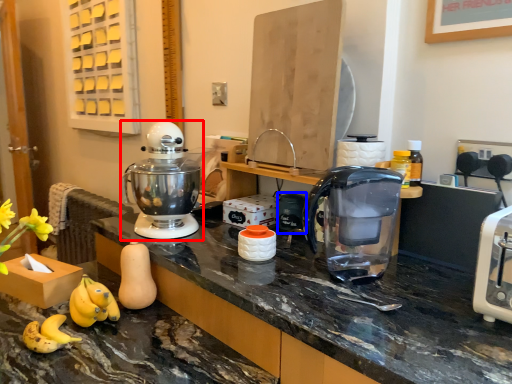
Question: Which object is closer to the camera taking this photo, mixer (highlighted by a red box) or appliance (highlighted by a blue box)?

Choices:
 (A) mixer
 (B) appliance

Answer: (A)